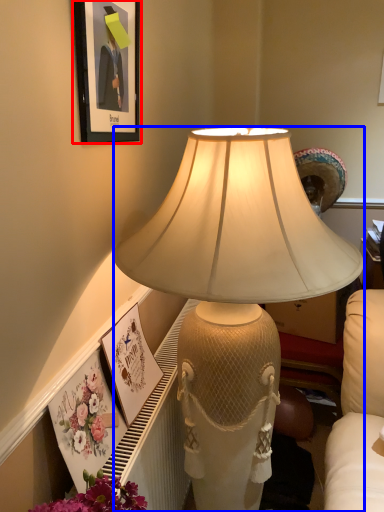
Question: Which of the following is the farthest to the observer, picture frame (highlighted by a red box) or lamp (highlighted by a blue box)?

Choices:
 (A) picture frame
 (B) lamp

Answer: (A)